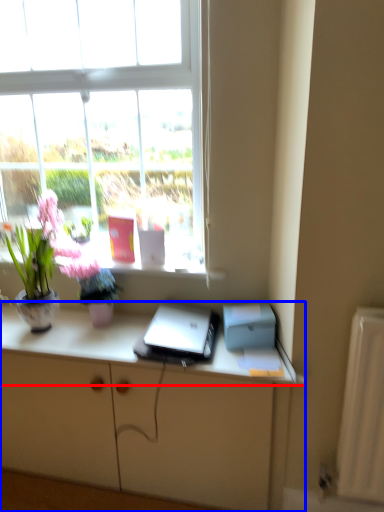
Question: Which object is further to the camera taking this photo, desk (highlighted by a red box) or cabinetry (highlighted by a blue box)?

Choices:
 (A) desk
 (B) cabinetry

Answer: (B)